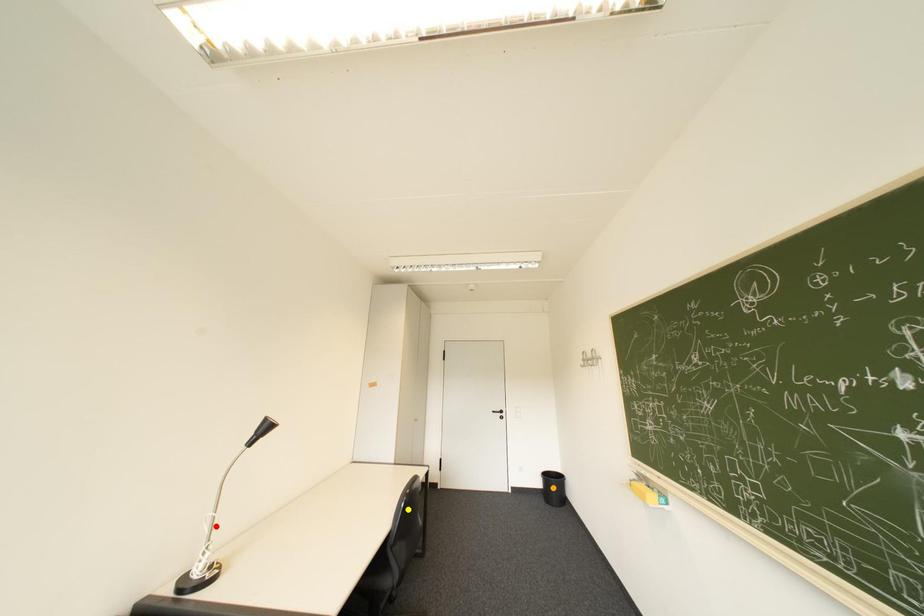
Order these from nearest to farthest:
- yellow point
- orange point
- red point

red point < yellow point < orange point